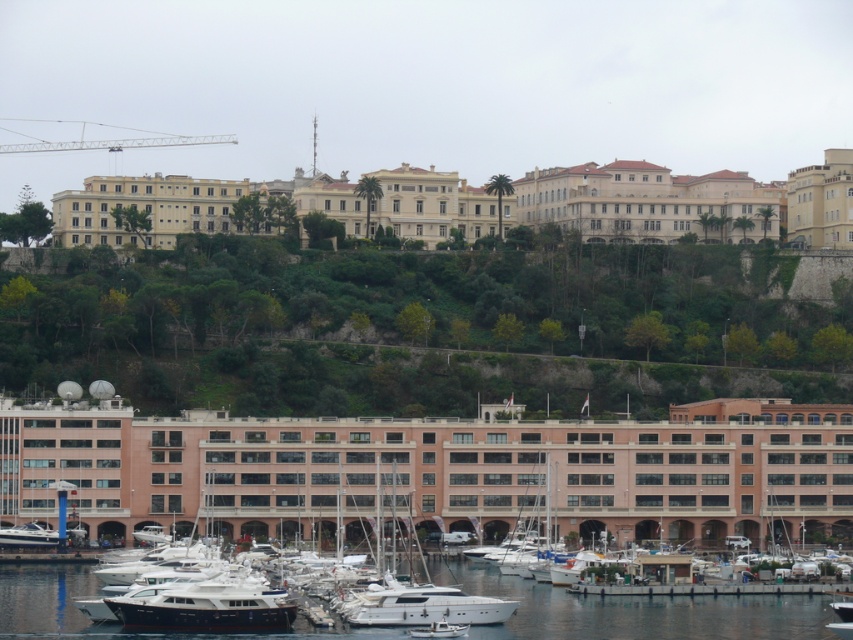
You are standing at the edge of the waterfront and want to cross from the white glossy boat at lower left to the white glossy water at lower center. Can you walk directly across the area between them?

The white glossy water at lower center is wider than the white glossy boat at lower left, but since the water is a body of water and not a solid surface, you cannot walk directly across the area between them.

You are a photographer planning to capture a shot of the white glossy yacht at center and the white glossy boat at lower left. Based on their positions, which one would appear closer to the camera in the final photo?

The white glossy yacht at center appears closer to the camera because it is located below the white glossy boat at lower left, indicating it is positioned in front in the scene.

From the picture: You are a photographer planning to capture the waterfront scene. You want to ensure that the white glossy yacht at center is framed alongside the white glossy water at lower center. Which object should you position wider in your camera frame to include both?

The white glossy water at lower center is wider than the white glossy yacht at center, so you should position the white glossy water at lower center wider in your camera frame to include both.